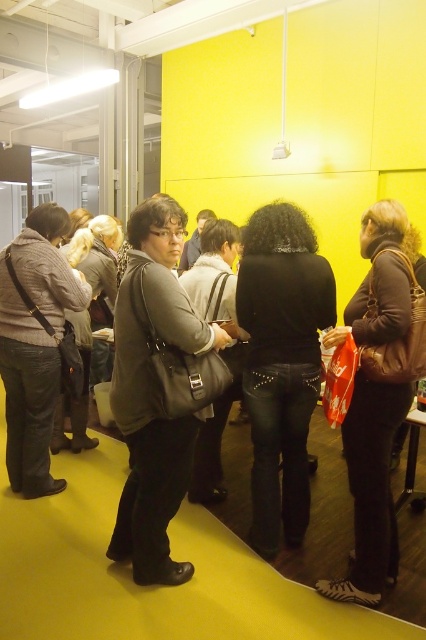
You are organizing a small event and need to place a sign on the wall. The sign must be positioned above the matte black bag at center to ensure it is visible to everyone. Based on the coordinates provided, where should the sign be placed relative to the bag?

The sign should be placed above the matte black bag at center since its coordinates are at point (158, 388), which indicates its position in the scene.

You are standing in the modern office space with bright yellow walls and want to pick up either the brown leather jacket at center or the black leather bag at center. Which one can you reach first without moving your position?

The brown leather jacket at center is closer to the viewer than the black leather bag at center, so you can reach the brown leather jacket at center first without moving.